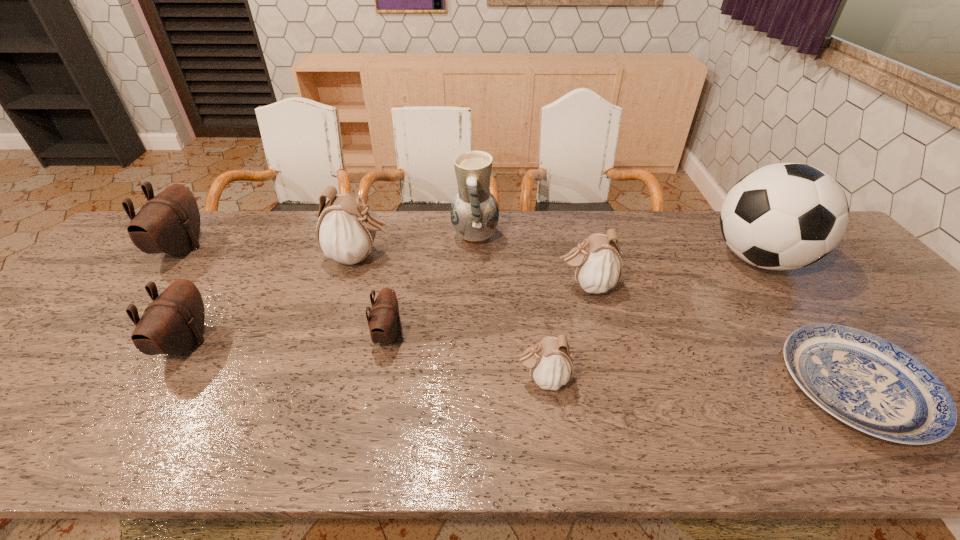
The width and height of the screenshot is (960, 540). I want to click on the fourth object from right to left, so click(x=550, y=361).

Identify the location of the smallest brown pouch. (384, 323).

What are the coordinates of `free space located 0.070m on the left of the black soccer ball` in the screenshot? It's located at (685, 259).

This screenshot has width=960, height=540. I want to click on free space located on either side of the fifth object from left to right, so click(610, 238).

What are the coordinates of `vacant space located 0.150m on the front-facing side of the biggest white pouch` in the screenshot? It's located at (444, 258).

The image size is (960, 540). I want to click on free space located with the flap open on the biggest brown pouch, so click(x=224, y=248).

This screenshot has height=540, width=960. In order to click on vacant point located 0.370m on the front-facing side of the third object from right to left in this screenshot , I will do `click(423, 286)`.

The width and height of the screenshot is (960, 540). Identify the location of free space located 0.360m on the front-facing side of the third object from right to left. (427, 286).

What are the coordinates of `vacant space located 0.340m on the front-facing side of the third object from right to left` in the screenshot? It's located at (434, 286).

At what (x,y) coordinates should I click in order to perform the action: click on free location located 0.100m with the flap open on the fifth pouch from right to left. Please return your answer as a coordinate pair (x, y). This screenshot has height=540, width=960. Looking at the image, I should click on (247, 343).